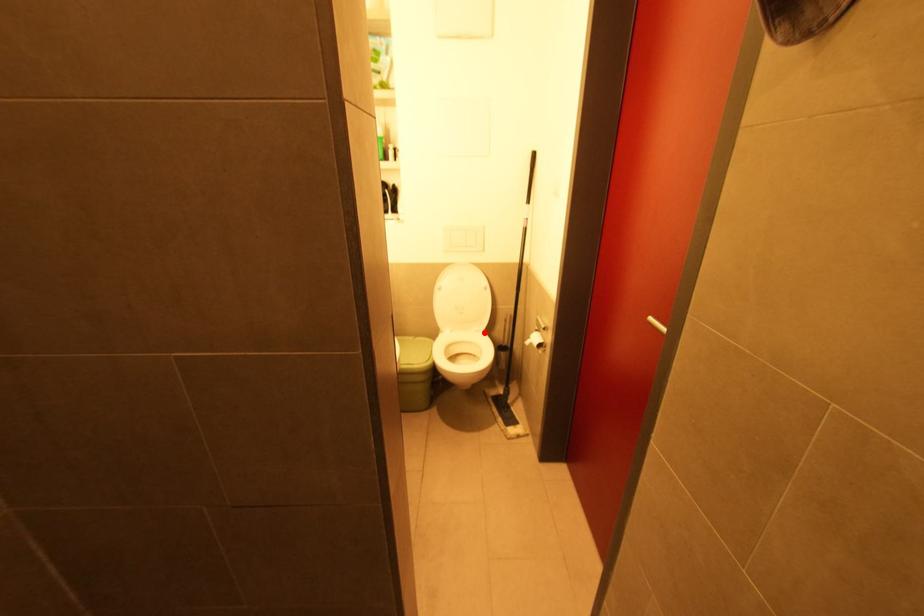
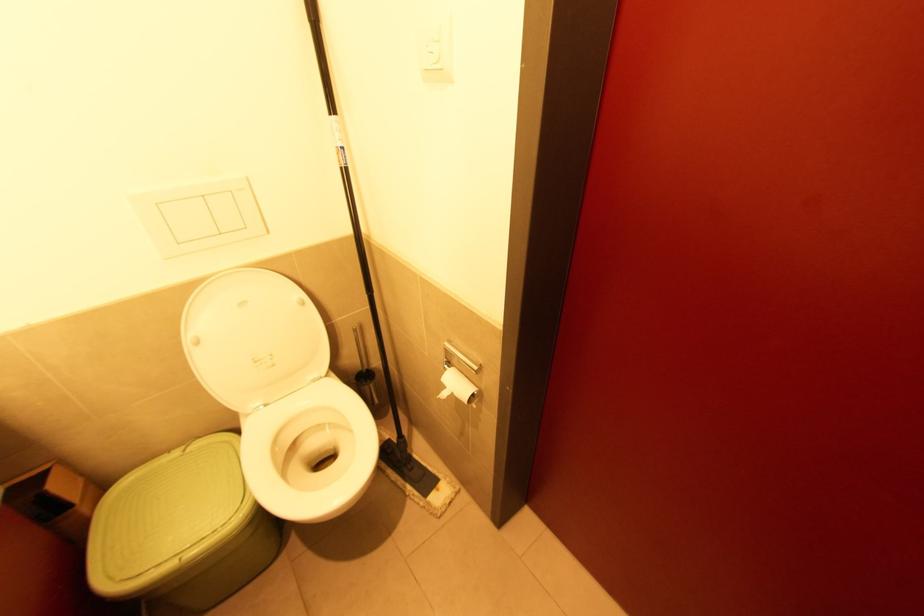
Question: I am providing you with two images of the same scene from different viewpoints. A red point is shown in image1. For the corresponding object point in image2, is it positioned nearer or farther from the camera?

Choices:
 (A) Nearer
 (B) Farther

Answer: (A)